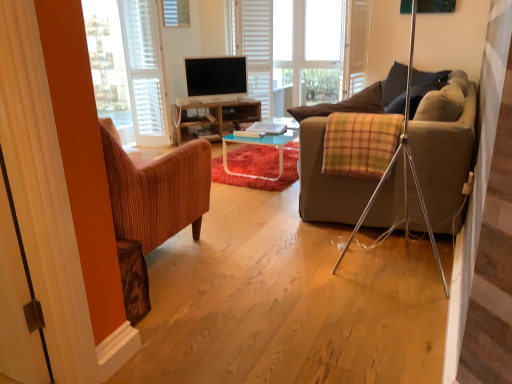
Question: Should I look upward or downward to see white wood bay window at center?

Choices:
 (A) up
 (B) down

Answer: (A)

Question: From the image's perspective, is white wood bay window at center located above white fabric curtain at left?

Choices:
 (A) no
 (B) yes

Answer: (B)

Question: Is white wood bay window at center directly adjacent to white fabric curtain at left?

Choices:
 (A) yes
 (B) no

Answer: (B)

Question: Considering the relative positions of white wood bay window at center and white fabric curtain at left in the image provided, is white wood bay window at center in front of white fabric curtain at left?

Choices:
 (A) no
 (B) yes

Answer: (A)

Question: Can you confirm if white wood bay window at center is bigger than white fabric curtain at left?

Choices:
 (A) no
 (B) yes

Answer: (B)

Question: Does white wood bay window at center have a lesser height compared to white fabric curtain at left?

Choices:
 (A) yes
 (B) no

Answer: (B)

Question: Does white wood bay window at center have a smaller size compared to white fabric curtain at left?

Choices:
 (A) yes
 (B) no

Answer: (B)

Question: Can you confirm if wooden desk at center is smaller than matte black tv at center?

Choices:
 (A) yes
 (B) no

Answer: (B)

Question: Considering the relative sizes of wooden desk at center and matte black tv at center in the image provided, is wooden desk at center thinner than matte black tv at center?

Choices:
 (A) yes
 (B) no

Answer: (B)

Question: Can you confirm if wooden desk at center is positioned to the right of matte black tv at center?

Choices:
 (A) no
 (B) yes

Answer: (A)

Question: From the image's perspective, is wooden desk at center below matte black tv at center?

Choices:
 (A) no
 (B) yes

Answer: (B)

Question: Is wooden desk at center wider than matte black tv at center?

Choices:
 (A) yes
 (B) no

Answer: (A)

Question: Can you confirm if wooden desk at center is taller than matte black tv at center?

Choices:
 (A) yes
 (B) no

Answer: (B)

Question: Is matte black tv at center wider than dark blue fabric pillow at upper right?

Choices:
 (A) no
 (B) yes

Answer: (A)